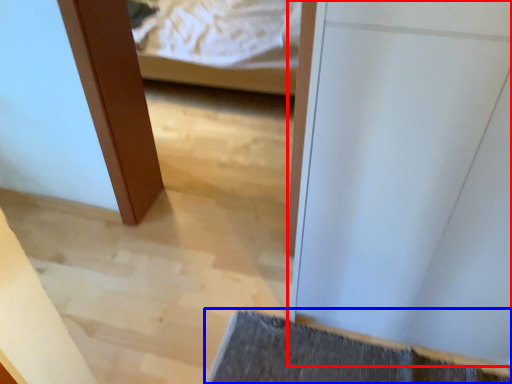
Question: Among these objects, which one is nearest to the camera, door (highlighted by a red box) or bath mat (highlighted by a blue box)?

Choices:
 (A) door
 (B) bath mat

Answer: (A)